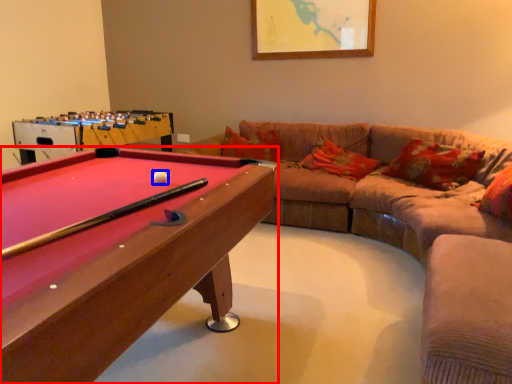
Question: Which point is closer to the camera, billiard table (highlighted by a red box) or ball (highlighted by a blue box)?

Choices:
 (A) billiard table
 (B) ball

Answer: (A)